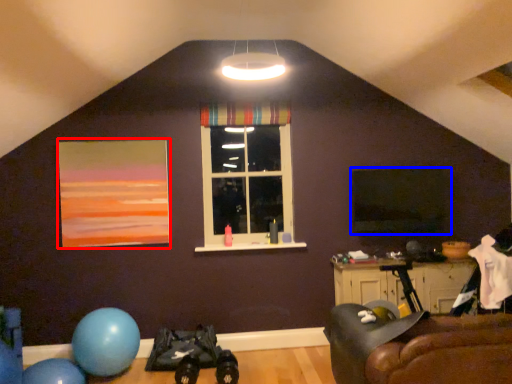
Question: Which object appears closest to the camera in this image, picture frame (highlighted by a red box) or window screen (highlighted by a blue box)?

Choices:
 (A) picture frame
 (B) window screen

Answer: (A)